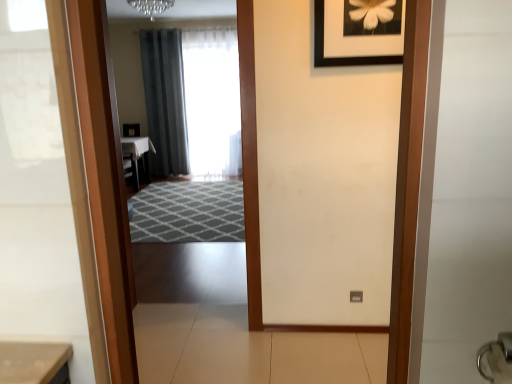
Question: Does silver metallic door handle at lower right have a greater width compared to black matte picture frame at upper center?

Choices:
 (A) yes
 (B) no

Answer: (A)

Question: From the image's perspective, is silver metallic door handle at lower right located beneath black matte picture frame at upper center?

Choices:
 (A) yes
 (B) no

Answer: (A)

Question: Is silver metallic door handle at lower right positioned far away from black matte picture frame at upper center?

Choices:
 (A) yes
 (B) no

Answer: (A)

Question: From the image's perspective, is silver metallic door handle at lower right over black matte picture frame at upper center?

Choices:
 (A) yes
 (B) no

Answer: (B)

Question: Is black matte picture frame at upper center at the back of silver metallic door handle at lower right?

Choices:
 (A) no
 (B) yes

Answer: (A)

Question: Is white glossy table at center wider or thinner than black matte picture frame at upper center?

Choices:
 (A) thin
 (B) wide

Answer: (B)

Question: Would you say white glossy table at center is to the left or to the right of black matte picture frame at upper center in the picture?

Choices:
 (A) left
 (B) right

Answer: (A)

Question: From the image's perspective, relative to black matte picture frame at upper center, is white glossy table at center above or below?

Choices:
 (A) above
 (B) below

Answer: (B)

Question: Is point (153, 147) positioned closer to the camera than point (372, 41)?

Choices:
 (A) closer
 (B) farther

Answer: (B)

Question: From a real-world perspective, is black matte picture frame at upper center positioned above or below white sheer curtain at center, the second curtain when ordered from left to right?

Choices:
 (A) below
 (B) above

Answer: (B)

Question: Is point (323, 46) positioned closer to the camera than point (197, 91)?

Choices:
 (A) farther
 (B) closer

Answer: (B)

Question: From their relative heights in the image, would you say black matte picture frame at upper center is taller or shorter than white sheer curtain at center, the second curtain when ordered from left to right?

Choices:
 (A) tall
 (B) short

Answer: (B)

Question: Relative to white sheer curtain at center, the first curtain from the right, is black matte picture frame at upper center in front or behind?

Choices:
 (A) front
 (B) behind

Answer: (A)

Question: From the image's perspective, is crystal glass chandelier at upper center located above or below dark gray fabric curtain at center, acting as the first curtain starting from the left?

Choices:
 (A) below
 (B) above

Answer: (B)

Question: Is crystal glass chandelier at upper center inside or outside of dark gray fabric curtain at center, which appears as the 2th curtain when viewed from the right?

Choices:
 (A) outside
 (B) inside

Answer: (A)